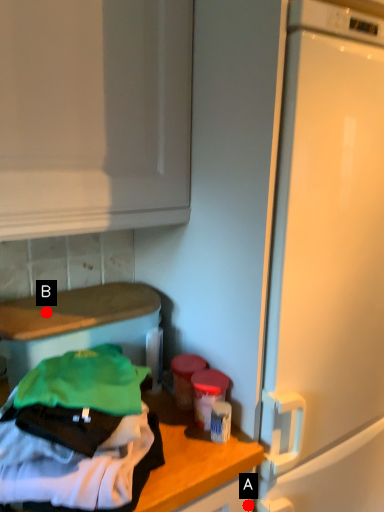
Question: Two points are circled on the image, labeled by A and B beside each circle. Which point appears closest to the camera in this image?

Choices:
 (A) A is closer
 (B) B is closer

Answer: (A)